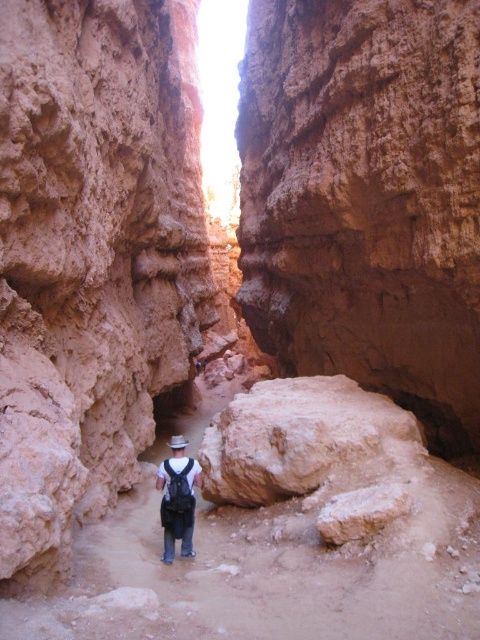
You are a hiker who wants to take a photo of the rustic sandstone rock at center and the matte black backpack at center. To get both in the frame, should you zoom in or out?

The rustic sandstone rock at center is above the matte black backpack at center, so you should zoom out to capture both in the frame.